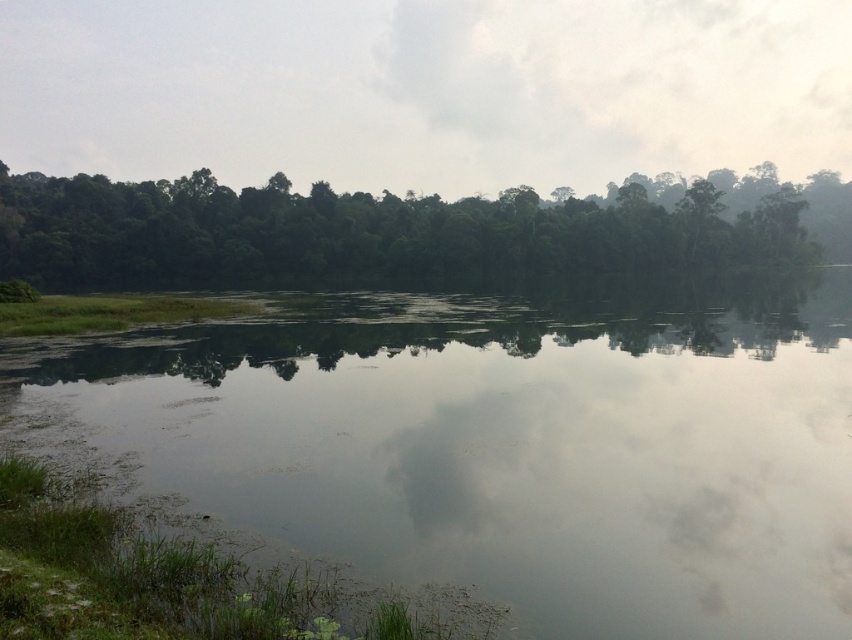
Question: In this image, where is green grassy river at center located relative to green leafy trees at upper center?

Choices:
 (A) above
 (B) below

Answer: (B)

Question: Among these objects, which one is nearest to the camera?

Choices:
 (A) green grassy river at center
 (B) green leafy trees at upper center

Answer: (A)

Question: Can you confirm if green grassy river at center is positioned above green leafy trees at upper center?

Choices:
 (A) no
 (B) yes

Answer: (A)

Question: Does green grassy river at center come behind green leafy trees at upper center?

Choices:
 (A) no
 (B) yes

Answer: (A)